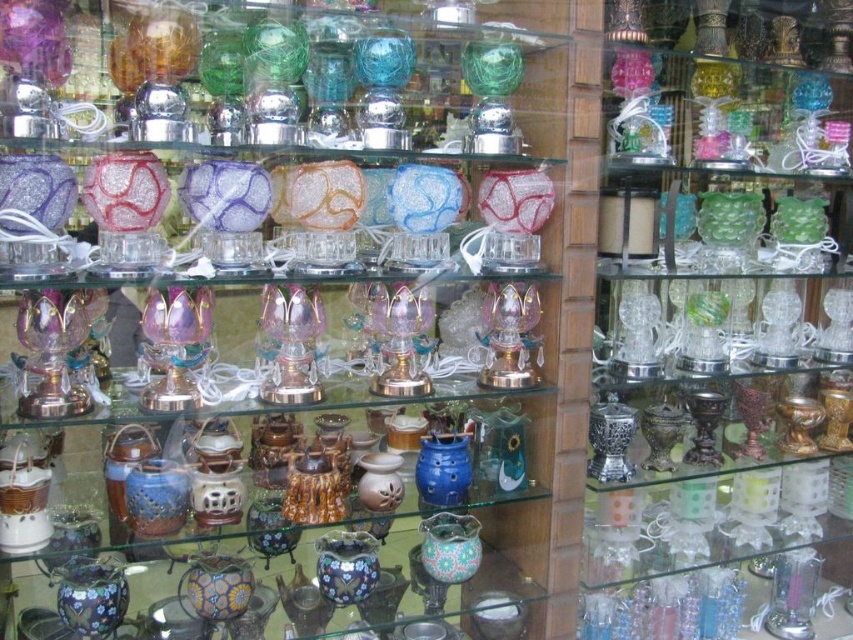
Question: Which point appears farthest from the camera in this image?

Choices:
 (A) (192, 276)
 (B) (763, 45)

Answer: (B)

Question: Can you confirm if matte glass candle at center is positioned to the left of blue glossy vase at center?

Choices:
 (A) yes
 (B) no

Answer: (A)

Question: Which object appears farthest from the camera in this image?

Choices:
 (A) matte glass candle at center
 (B) translucent glass candle at center

Answer: (B)

Question: Does translucent glass candle at center have a lesser width compared to blue glossy vase at center?

Choices:
 (A) no
 (B) yes

Answer: (A)

Question: Is matte glass candle at center further to the viewer compared to translucent glass candle at center?

Choices:
 (A) yes
 (B) no

Answer: (B)

Question: Which point is closer to the camera?

Choices:
 (A) (277, 468)
 (B) (428, 465)

Answer: (A)